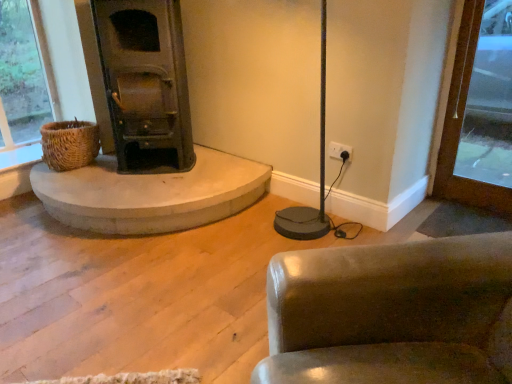
Question: Considering the relative positions of brown wood door at right and leather-like brown chair at lower right in the image provided, is brown wood door at right to the left or to the right of leather-like brown chair at lower right?

Choices:
 (A) left
 (B) right

Answer: (B)

Question: Considering the positions of point (462, 31) and point (384, 332), is point (462, 31) closer or farther from the camera than point (384, 332)?

Choices:
 (A) farther
 (B) closer

Answer: (A)

Question: Considering the real-world distances, which object is farthest from the brown wood door at right?

Choices:
 (A) leather-like brown chair at lower right
 (B) woven brown basket at left
 (C) dark green metal wood burning stove at left

Answer: (B)

Question: Estimate the real-world distances between objects in this image. Which object is farther from the brown wood door at right?

Choices:
 (A) dark green metal wood burning stove at left
 (B) woven brown basket at left
 (C) leather-like brown chair at lower right

Answer: (B)